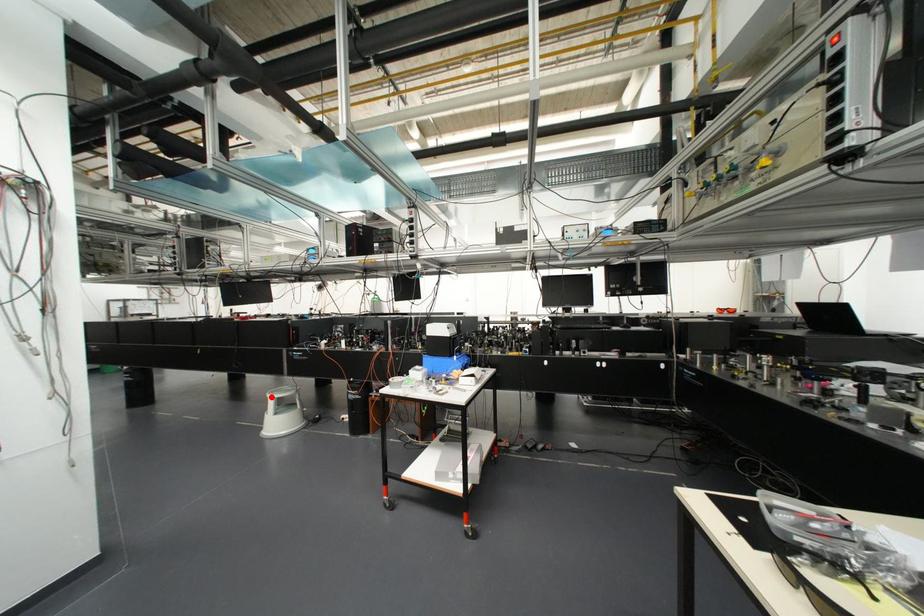
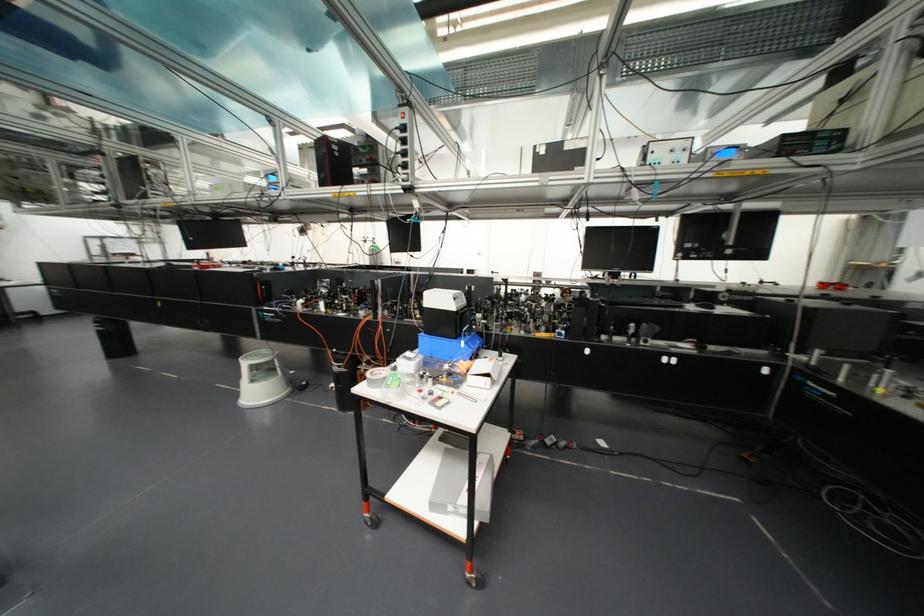
In the second image, find the point that corresponds to the highlighted location in the first image.

(244, 363)